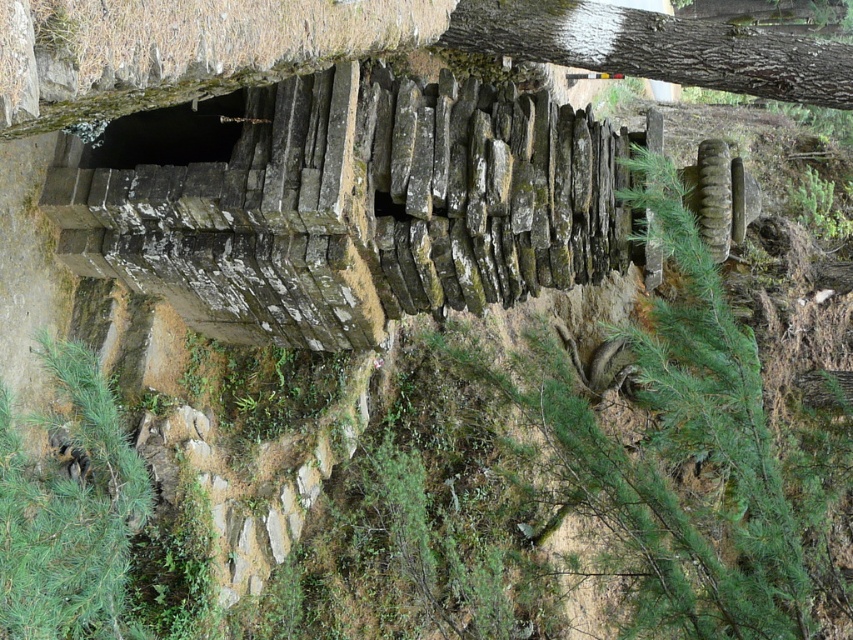
Can you confirm if green mossy stone at center is bigger than smooth bark tree trunk at upper right?

Indeed, green mossy stone at center has a larger size compared to smooth bark tree trunk at upper right.

Is green mossy stone at center smaller than smooth bark tree trunk at upper right?

Actually, green mossy stone at center might be larger than smooth bark tree trunk at upper right.

I want to click on green mossy stone at center, so coord(701,458).

Locate an element on the screen. This screenshot has width=853, height=640. green mossy stone at center is located at coordinates (701, 458).